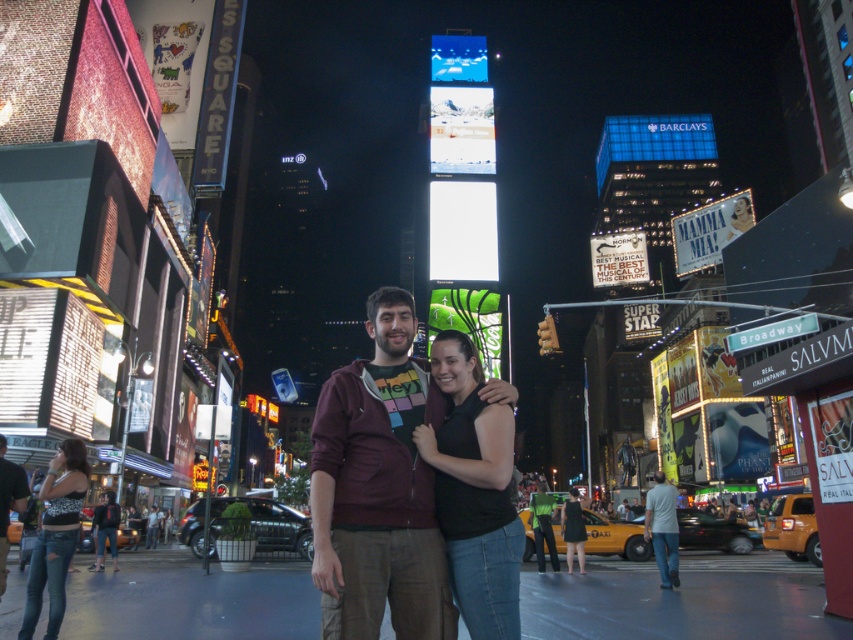
Question: Is gray cotton shirt at lower right wider than black dress at center?

Choices:
 (A) yes
 (B) no

Answer: (B)

Question: Which point is farther to the camera?

Choices:
 (A) dark brown leather jacket at lower left
 (B) black dress at center
 (C) maroon hoodie at center
 (D) distressed denim jeans at lower left

Answer: (B)

Question: Can you confirm if gray cotton shirt at lower right is positioned to the left of black dress at center?

Choices:
 (A) no
 (B) yes

Answer: (B)

Question: Which point is closer to the camera?

Choices:
 (A) (22, 470)
 (B) (316, 570)
 (C) (660, 518)

Answer: (B)

Question: Is the position of maroon hoodie at center more distant than that of black dress at center?

Choices:
 (A) yes
 (B) no

Answer: (B)

Question: Which object is farther from the camera taking this photo?

Choices:
 (A) distressed denim jeans at lower left
 (B) black matte tank top at center

Answer: (A)